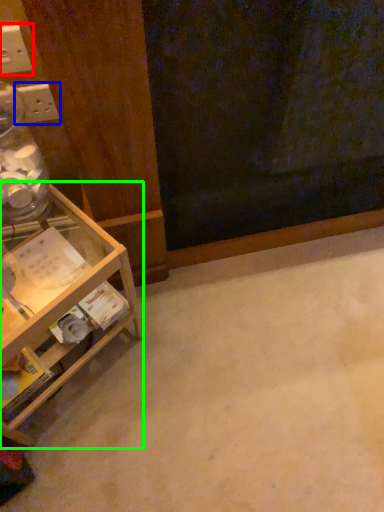
Question: Considering the real-world distances, which object is farthest from electric outlet (highlighted by a red box)? electric outlet (highlighted by a blue box) or shelf (highlighted by a green box)?

Choices:
 (A) electric outlet
 (B) shelf

Answer: (B)